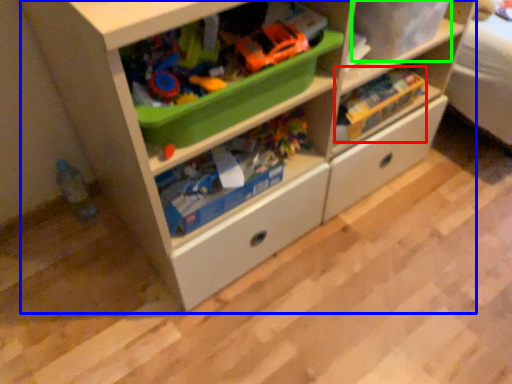
Question: Which object is positioned closest to toy (highlighted by a red box)? Select from chest of drawers (highlighted by a blue box) and storage box (highlighted by a green box).

Choices:
 (A) chest of drawers
 (B) storage box

Answer: (B)